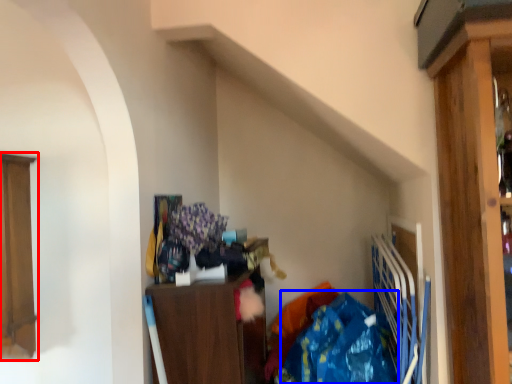
Question: Which object appears closest to the camera in this image, cabinetry (highlighted by a red box) or clothing (highlighted by a blue box)?

Choices:
 (A) cabinetry
 (B) clothing

Answer: (B)